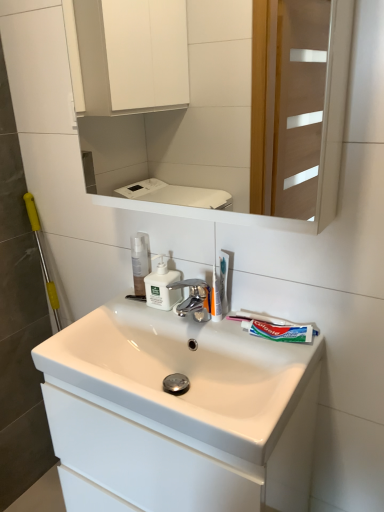
Question: Could you tell me if translucent plastic toothbrush at center is facing translucent plastic toothbrush at upper center?

Choices:
 (A) yes
 (B) no

Answer: (A)

Question: Is translucent plastic toothbrush at center wider than translucent plastic toothbrush at upper center?

Choices:
 (A) yes
 (B) no

Answer: (A)

Question: Does translucent plastic toothbrush at center appear on the right side of translucent plastic toothbrush at upper center?

Choices:
 (A) no
 (B) yes

Answer: (A)

Question: Can you confirm if translucent plastic toothbrush at center is bigger than translucent plastic toothbrush at upper center?

Choices:
 (A) no
 (B) yes

Answer: (B)

Question: Does translucent plastic toothbrush at center have a lesser height compared to translucent plastic toothbrush at upper center?

Choices:
 (A) no
 (B) yes

Answer: (A)

Question: From a real-world perspective, relative to transparent plastic mouthwash at center, is white glossy sink at center vertically above or below?

Choices:
 (A) below
 (B) above

Answer: (A)

Question: From the image's perspective, is white glossy sink at center located above or below transparent plastic mouthwash at center?

Choices:
 (A) below
 (B) above

Answer: (A)

Question: Based on their sizes in the image, would you say white glossy sink at center is bigger or smaller than transparent plastic mouthwash at center?

Choices:
 (A) big
 (B) small

Answer: (A)

Question: Considering the positions of white glossy sink at center and transparent plastic mouthwash at center in the image, is white glossy sink at center wider or thinner than transparent plastic mouthwash at center?

Choices:
 (A) wide
 (B) thin

Answer: (A)

Question: From their relative heights in the image, would you say white glossy sink at center is taller or shorter than translucent plastic toothbrush at upper center?

Choices:
 (A) tall
 (B) short

Answer: (A)

Question: Relative to translucent plastic toothbrush at upper center, is white glossy sink at center in front or behind?

Choices:
 (A) behind
 (B) front

Answer: (B)

Question: From a real-world perspective, is white glossy sink at center positioned above or below translucent plastic toothbrush at upper center?

Choices:
 (A) above
 (B) below

Answer: (B)

Question: Is point (213, 476) closer or farther from the camera than point (226, 286)?

Choices:
 (A) farther
 (B) closer

Answer: (B)

Question: Considering their positions, is translucent plastic toothbrush at upper center located in front of or behind white glossy sink at center?

Choices:
 (A) behind
 (B) front

Answer: (A)

Question: Is translucent plastic toothbrush at upper center wider or thinner than white glossy sink at center?

Choices:
 (A) thin
 (B) wide

Answer: (A)